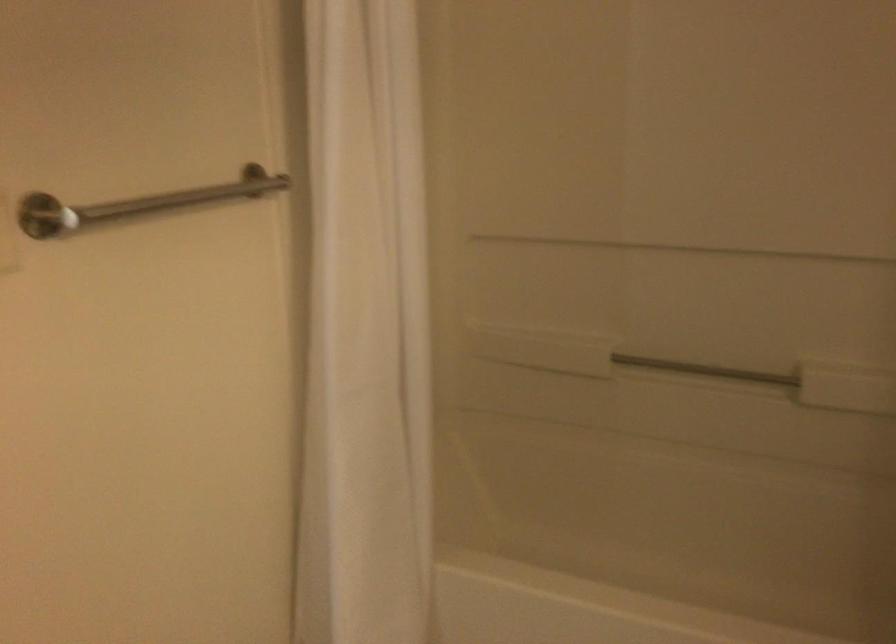
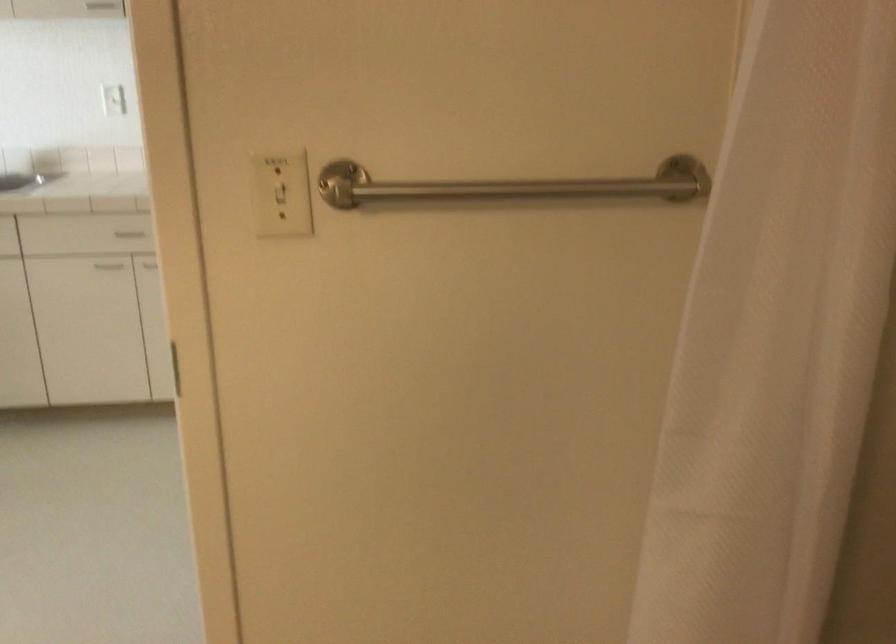
Question: The images are taken continuously from a first-person perspective. In which direction is your viewpoint rotating?

Choices:
 (A) Left
 (B) Right
 (C) Up
 (D) Down

Answer: (A)